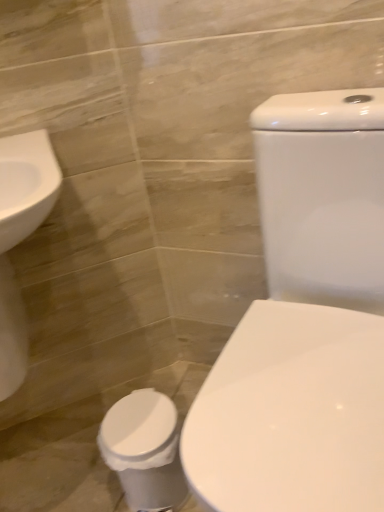
Question: Is white glossy toilet at center wider or thinner than white glossy toilet bowl at lower left?

Choices:
 (A) wide
 (B) thin

Answer: (A)

Question: From their relative heights in the image, would you say white glossy toilet at center is taller or shorter than white glossy toilet bowl at lower left?

Choices:
 (A) short
 (B) tall

Answer: (B)

Question: Is white glossy toilet at center in front of or behind white glossy toilet bowl at lower left in the image?

Choices:
 (A) front
 (B) behind

Answer: (A)

Question: Considering the relative positions of white glossy toilet bowl at lower left and white glossy toilet at center in the image provided, is white glossy toilet bowl at lower left to the left or to the right of white glossy toilet at center?

Choices:
 (A) right
 (B) left

Answer: (B)

Question: From their relative heights in the image, would you say white glossy toilet bowl at lower left is taller or shorter than white glossy toilet at center?

Choices:
 (A) tall
 (B) short

Answer: (B)

Question: From a real-world perspective, is white glossy toilet bowl at lower left positioned above or below white glossy toilet at center?

Choices:
 (A) below
 (B) above

Answer: (A)

Question: Choose the correct answer: Is white glossy toilet bowl at lower left inside white glossy toilet at center or outside it?

Choices:
 (A) inside
 (B) outside

Answer: (B)